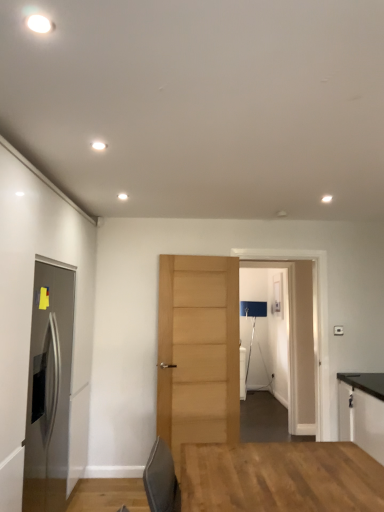
Find the location of a particular element. Image resolution: width=384 pixels, height=512 pixels. light brown wood door at center, which is the 1th door from right to left is located at coordinates (198, 351).

You are a GUI agent. You are given a task and a screenshot of the screen. Output one action in this format:
    pyautogui.click(x=<x>, y=<y>)
    Task: Click on the transparent glass door at center
    This screenshot has width=384, height=512.
    Given the screenshot: What is the action you would take?
    pyautogui.click(x=285, y=337)

This screenshot has height=512, width=384. In order to click on black laminate cabinet at right in this screenshot , I will do point(362,411).

Where is `satin stainless steel refrigerator at left, which ranks as the first door in left-to-right order`? The image size is (384, 512). satin stainless steel refrigerator at left, which ranks as the first door in left-to-right order is located at coordinates (49, 389).

How many degrees apart are the facing directions of black laminate cabinet at right and transparent glass door at center?

black laminate cabinet at right and transparent glass door at center are facing 90.3 degrees away from each other.

Considering the sizes of objects black laminate cabinet at right and transparent glass door at center in the image provided, who is bigger, black laminate cabinet at right or transparent glass door at center?

Bigger between the two is black laminate cabinet at right.

Is black laminate cabinet at right in front of or behind transparent glass door at center in the image?

black laminate cabinet at right is in front of transparent glass door at center.

Locate an element on the screen. glass door on the left side of black laminate cabinet at right is located at coordinates (285, 337).

Considering the relative sizes of black laminate cabinet at right and satin stainless steel refrigerator at left, acting as the second door starting from the back, in the image provided, is black laminate cabinet at right shorter than satin stainless steel refrigerator at left, acting as the second door starting from the back,?

Yes, black laminate cabinet at right is shorter than satin stainless steel refrigerator at left, acting as the second door starting from the back.

Between black laminate cabinet at right and satin stainless steel refrigerator at left, arranged as the 1th door when viewed from the front, which one is positioned in front?

satin stainless steel refrigerator at left, arranged as the 1th door when viewed from the front, is more forward.

Can you confirm if black laminate cabinet at right is positioned to the left of satin stainless steel refrigerator at left, acting as the second door starting from the back?

Incorrect, black laminate cabinet at right is not on the left side of satin stainless steel refrigerator at left, acting as the second door starting from the back.

Based on the photo, is black laminate cabinet at right aimed at satin stainless steel refrigerator at left, the second door when ordered from right to left?

Yes, black laminate cabinet at right is aimed at satin stainless steel refrigerator at left, the second door when ordered from right to left.

Which is more to the right, satin stainless steel refrigerator at left, the second door when ordered from right to left, or black laminate cabinet at right?

From the viewer's perspective, black laminate cabinet at right appears more on the right side.

Is black laminate cabinet at right located within satin stainless steel refrigerator at left, acting as the second door starting from the back?

No, satin stainless steel refrigerator at left, acting as the second door starting from the back, does not contain black laminate cabinet at right.

Based on the photo, is satin stainless steel refrigerator at left, the second door when ordered from right to left, positioned far away from black laminate cabinet at right?

Absolutely, satin stainless steel refrigerator at left, the second door when ordered from right to left, is distant from black laminate cabinet at right.

Does satin stainless steel refrigerator at left, arranged as the 1th door when viewed from the front, turn towards black laminate cabinet at right?

Yes, satin stainless steel refrigerator at left, arranged as the 1th door when viewed from the front, is facing black laminate cabinet at right.

From a real-world perspective, is light brown wood door at center, which is the 1th door from right to left, positioned under transparent glass door at center based on gravity?

Yes.

Would you consider light brown wood door at center, marked as the second door in a front-to-back arrangement, to be distant from transparent glass door at center?

That's right, there is a large distance between light brown wood door at center, marked as the second door in a front-to-back arrangement, and transparent glass door at center.

In the image, is light brown wood door at center, which is the 1th door from right to left, on the left side or the right side of transparent glass door at center?

From the image, it's evident that light brown wood door at center, which is the 1th door from right to left, is to the left of transparent glass door at center.

Is transparent glass door at center located within light brown wood door at center, the first door in the back-to-front sequence?

No, light brown wood door at center, the first door in the back-to-front sequence, does not contain transparent glass door at center.

Is black laminate cabinet at right far away from light brown wood door at center, the first door in the back-to-front sequence?

black laminate cabinet at right is far away from light brown wood door at center, the first door in the back-to-front sequence.

From a real-world perspective, between black laminate cabinet at right and light brown wood door at center, the first door in the back-to-front sequence, who is vertically lower?

black laminate cabinet at right, from a real-world perspective.

Considering the relative sizes of black laminate cabinet at right and light brown wood door at center, which is the 1th door from right to left, in the image provided, is black laminate cabinet at right thinner than light brown wood door at center, which is the 1th door from right to left,?

No, black laminate cabinet at right is not thinner than light brown wood door at center, which is the 1th door from right to left.

Is black laminate cabinet at right spatially inside light brown wood door at center, which is the 1th door from right to left, or outside of it?

black laminate cabinet at right is outside light brown wood door at center, which is the 1th door from right to left.

From the image's perspective, would you say satin stainless steel refrigerator at left, arranged as the 1th door when viewed from the front, is positioned over transparent glass door at center?

No, from the image's perspective, satin stainless steel refrigerator at left, arranged as the 1th door when viewed from the front, is not above transparent glass door at center.

In the scene shown: Is satin stainless steel refrigerator at left, acting as the second door starting from the back, taller than transparent glass door at center?

Incorrect, the height of satin stainless steel refrigerator at left, acting as the second door starting from the back, is not larger of that of transparent glass door at center.

From a real-world perspective, which object stands above the other?

From a 3D spatial view, transparent glass door at center is above.

Which object is more forward, light brown wood door at center, marked as the second door in a front-to-back arrangement, or black laminate cabinet at right?

black laminate cabinet at right.

In terms of width, does light brown wood door at center, which is the 1th door from right to left, look wider or thinner when compared to black laminate cabinet at right?

Considering their sizes, light brown wood door at center, which is the 1th door from right to left, looks slimmer than black laminate cabinet at right.

Does light brown wood door at center, which is the 1th door from right to left, turn towards black laminate cabinet at right?

No, light brown wood door at center, which is the 1th door from right to left, does not turn towards black laminate cabinet at right.

From the image's perspective, is light brown wood door at center, which is counted as the 2th door, starting from the left, over black laminate cabinet at right?

Yes, from the image's perspective, light brown wood door at center, which is counted as the 2th door, starting from the left, is over black laminate cabinet at right.

What are the coordinates of `cabinetry below the transparent glass door at center (from a real-world perspective)` in the screenshot? It's located at tap(362, 411).

Which door is the 2nd one when counting from the left side of the black laminate cabinet at right? Please provide its 2D coordinates.

[(49, 389)]

Which object lies nearer to the anchor point satin stainless steel refrigerator at left, arranged as the 1th door when viewed from the front, transparent glass door at center or black laminate cabinet at right?

black laminate cabinet at right is closer to satin stainless steel refrigerator at left, arranged as the 1th door when viewed from the front.

Estimate the real-world distances between objects in this image. Which object is further from satin stainless steel refrigerator at left, the second door when ordered from right to left, black laminate cabinet at right or transparent glass door at center?

transparent glass door at center is positioned further to the anchor satin stainless steel refrigerator at left, the second door when ordered from right to left.

Estimate the real-world distances between objects in this image. Which object is further from transparent glass door at center, black laminate cabinet at right or satin stainless steel refrigerator at left, the second door when ordered from right to left?

satin stainless steel refrigerator at left, the second door when ordered from right to left, is further to transparent glass door at center.

Considering their positions, is transparent glass door at center positioned further to satin stainless steel refrigerator at left, which ranks as the first door in left-to-right order, than light brown wood door at center, marked as the second door in a front-to-back arrangement?

transparent glass door at center is further to satin stainless steel refrigerator at left, which ranks as the first door in left-to-right order.

In the scene shown: Which object lies further to the anchor point light brown wood door at center, marked as the second door in a front-to-back arrangement, transparent glass door at center or black laminate cabinet at right?

The object further to light brown wood door at center, marked as the second door in a front-to-back arrangement, is transparent glass door at center.

From the image, which object appears to be farther from transparent glass door at center, light brown wood door at center, the first door in the back-to-front sequence, or satin stainless steel refrigerator at left, arranged as the 1th door when viewed from the front?

satin stainless steel refrigerator at left, arranged as the 1th door when viewed from the front, is positioned further to the anchor transparent glass door at center.

From the picture: Considering their positions, is satin stainless steel refrigerator at left, which ranks as the first door in left-to-right order, positioned further to light brown wood door at center, marked as the second door in a front-to-back arrangement, than black laminate cabinet at right?

The object further to light brown wood door at center, marked as the second door in a front-to-back arrangement, is black laminate cabinet at right.

Considering their positions, is satin stainless steel refrigerator at left, the second door when ordered from right to left, positioned closer to black laminate cabinet at right than light brown wood door at center, which is the 1th door from right to left?

light brown wood door at center, which is the 1th door from right to left, lies closer to black laminate cabinet at right than the other object.

Identify the location of glass door located between satin stainless steel refrigerator at left, the second door when ordered from right to left, and black laminate cabinet at right in the left-right direction. (285, 337).

Identify the location of glass door located between light brown wood door at center, the first door in the back-to-front sequence, and black laminate cabinet at right in the left-right direction. (285, 337).

You are a GUI agent. You are given a task and a screenshot of the screen. Output one action in this format:
    pyautogui.click(x=<x>, y=<y>)
    Task: Click on the door between satin stainless steel refrigerator at left, which ranks as the first door in left-to-right order, and transparent glass door at center
    Image resolution: width=384 pixels, height=512 pixels.
    Given the screenshot: What is the action you would take?
    pyautogui.click(x=198, y=351)

At what (x,y) coordinates should I click in order to perform the action: click on door between satin stainless steel refrigerator at left, acting as the second door starting from the back, and black laminate cabinet at right, in the horizontal direction. Please return your answer as a coordinate pair (x, y). Image resolution: width=384 pixels, height=512 pixels. Looking at the image, I should click on (198, 351).